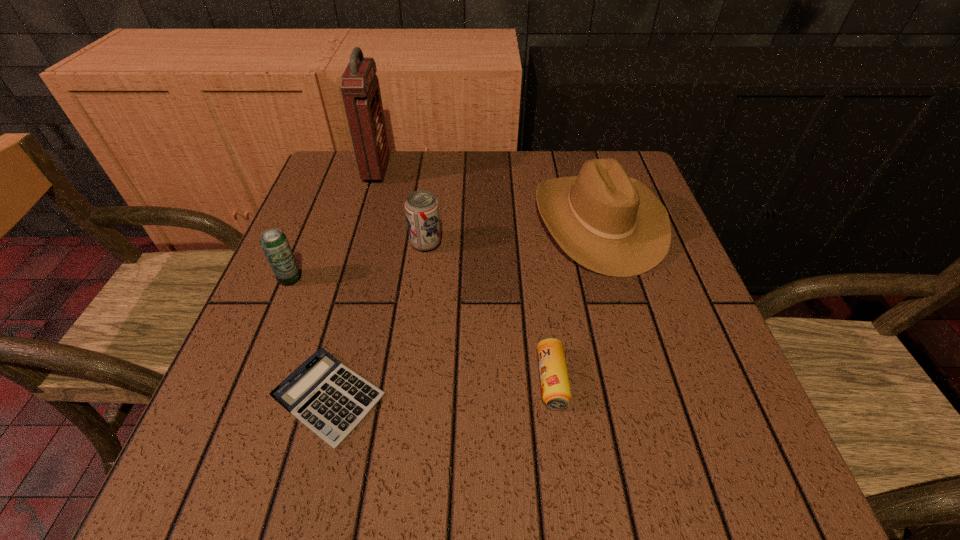
Where is `blank area in the image that satisfies the following two spatial constraints: 1. on the front-facing side of the first-aid kit; 2. on the left side of the rightmost beer can`? The image size is (960, 540). blank area in the image that satisfies the following two spatial constraints: 1. on the front-facing side of the first-aid kit; 2. on the left side of the rightmost beer can is located at coordinates (314, 380).